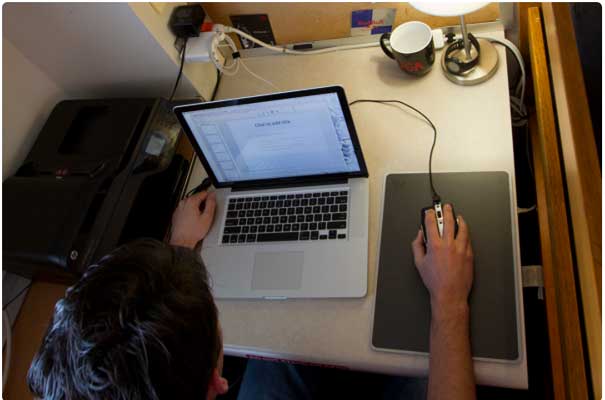
You are a GUI agent. You are given a task and a screenshot of the screen. Output one action in this format:
    pyautogui.click(x=<x>, y=<y>)
    Task: Click on the peach back wall
    
    Given the screenshot: What is the action you would take?
    pyautogui.click(x=305, y=19)